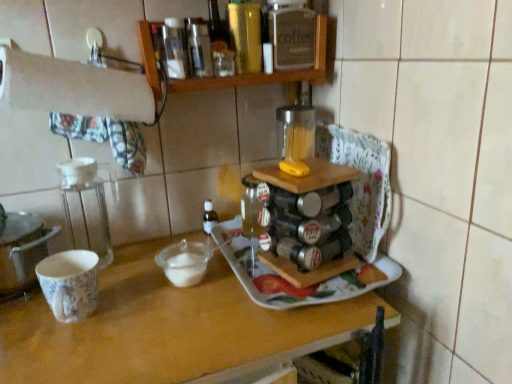
At what (x,y) coordinates should I click in order to perform the action: click on free location to the right of porcelain floral mug at left. Please return your answer as a coordinate pair (x, y). Looking at the image, I should click on (156, 318).